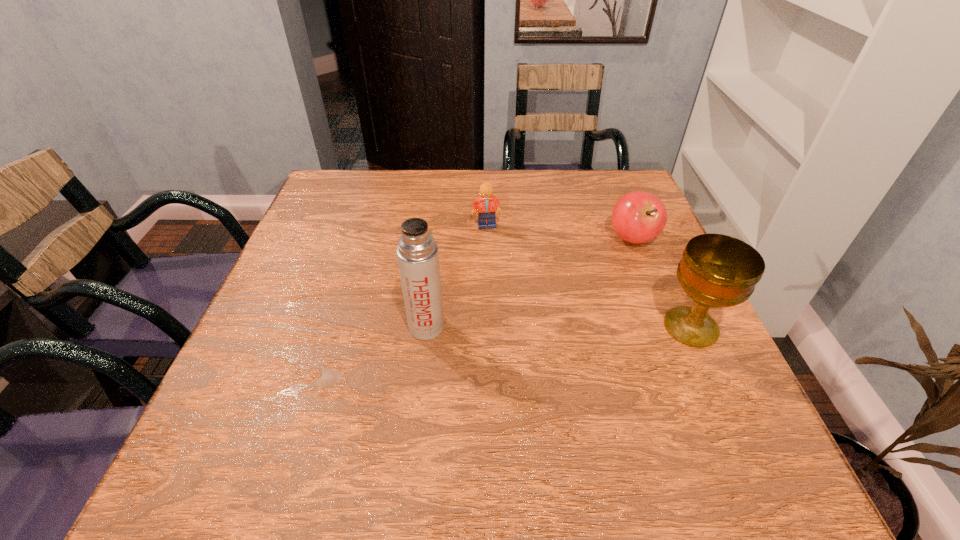
Where is `thermos bottle`? This screenshot has width=960, height=540. thermos bottle is located at coordinates (417, 253).

In order to click on the tallest object in this screenshot , I will do `click(417, 253)`.

Locate an element on the screen. chalice is located at coordinates (716, 271).

Find the location of a particular element. This screenshot has height=540, width=960. the third object from right to left is located at coordinates (484, 203).

The width and height of the screenshot is (960, 540). Identify the location of apple. (638, 216).

The image size is (960, 540). In order to click on vacant area located on the left of the tallest object in this screenshot , I will do `click(334, 327)`.

Find the location of `blank area located 0.160m on the back of the chalice`. blank area located 0.160m on the back of the chalice is located at coordinates (658, 256).

At what (x,y) coordinates should I click in order to perform the action: click on free point located on the front-facing side of the Lego. Please return your answer as a coordinate pair (x, y). The image size is (960, 540). Looking at the image, I should click on (532, 278).

Identify the location of vacant area located 0.330m on the front-facing side of the Lego. The width and height of the screenshot is (960, 540). (564, 316).

I want to click on blank area located on the front-facing side of the Lego, so click(532, 278).